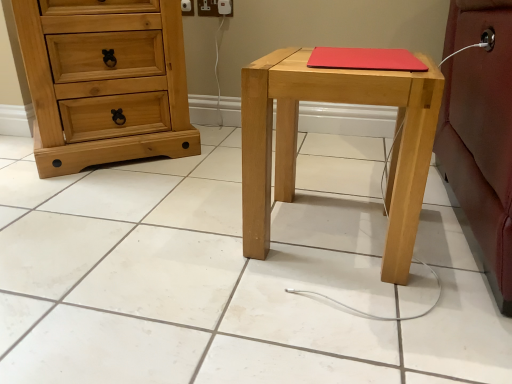
This screenshot has width=512, height=384. I want to click on vacant space situated above natural wood stool at center (from a real-world perspective), so click(345, 58).